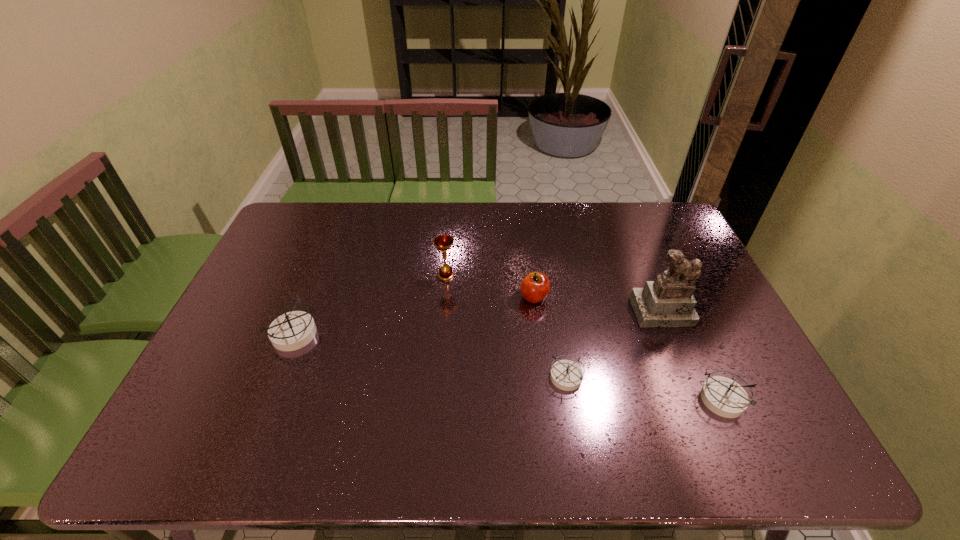
To make them evenly spaced by inserting another compass among them, please locate a free space for this new compass. Please provide its 2D coordinates. Your answer should be formatted as a tuple, i.e. [(x, y)], where the tuple contains the x and y coordinates of a point satisfying the conditions above.

[(424, 355)]